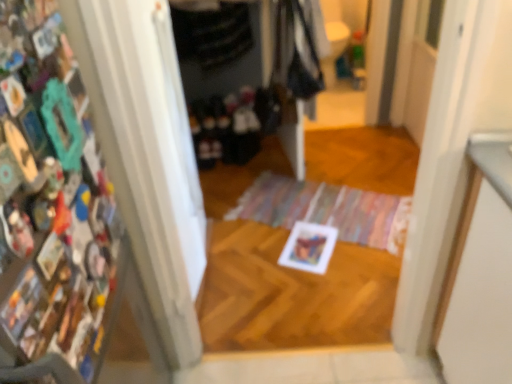
Question: Is dark fabric clothes at center, arranged as the first clothing when ordered from the bottom, closer to camera compared to dark gray fabric at upper center, the 2th clothing ordered from the bottom?

Choices:
 (A) no
 (B) yes

Answer: (A)

Question: Is the depth of dark fabric clothes at center, arranged as the first clothing when ordered from the bottom, greater than that of dark gray fabric at upper center, the first clothing viewed from the top?

Choices:
 (A) no
 (B) yes

Answer: (B)

Question: Considering the relative sizes of dark fabric clothes at center, arranged as the first clothing when ordered from the bottom, and dark gray fabric at upper center, the 2th clothing ordered from the bottom, in the image provided, is dark fabric clothes at center, arranged as the first clothing when ordered from the bottom, wider than dark gray fabric at upper center, the 2th clothing ordered from the bottom,?

Choices:
 (A) no
 (B) yes

Answer: (B)

Question: Does dark fabric clothes at center, arranged as the first clothing when ordered from the bottom, have a lesser width compared to dark gray fabric at upper center, the first clothing viewed from the top?

Choices:
 (A) no
 (B) yes

Answer: (A)

Question: Could you tell me if dark fabric clothes at center, which ranks as the 2th clothing in top-to-bottom order, is turned towards dark gray fabric at upper center, the 2th clothing ordered from the bottom?

Choices:
 (A) no
 (B) yes

Answer: (A)

Question: Is dark fabric clothes at center, arranged as the first clothing when ordered from the bottom, completely or partially outside of dark gray fabric at upper center, the 2th clothing ordered from the bottom?

Choices:
 (A) yes
 (B) no

Answer: (A)

Question: Does multicolored collage at left come behind dark fabric clothes at center, which ranks as the 2th clothing in top-to-bottom order?

Choices:
 (A) no
 (B) yes

Answer: (A)

Question: From a real-world perspective, is multicolored collage at left beneath dark fabric clothes at center, arranged as the first clothing when ordered from the bottom?

Choices:
 (A) yes
 (B) no

Answer: (B)

Question: Can you confirm if multicolored collage at left is thinner than dark fabric clothes at center, arranged as the first clothing when ordered from the bottom?

Choices:
 (A) yes
 (B) no

Answer: (A)

Question: Considering the relative positions of multicolored collage at left and dark fabric clothes at center, which ranks as the 2th clothing in top-to-bottom order, in the image provided, is multicolored collage at left to the left of dark fabric clothes at center, which ranks as the 2th clothing in top-to-bottom order, from the viewer's perspective?

Choices:
 (A) yes
 (B) no

Answer: (A)

Question: From the image's perspective, is multicolored collage at left below dark fabric clothes at center, arranged as the first clothing when ordered from the bottom?

Choices:
 (A) yes
 (B) no

Answer: (A)

Question: Are multicolored collage at left and dark fabric clothes at center, arranged as the first clothing when ordered from the bottom, located far from each other?

Choices:
 (A) no
 (B) yes

Answer: (B)

Question: From the image's perspective, is multicolored collage at left below dark gray fabric at upper center, the first clothing viewed from the top?

Choices:
 (A) yes
 (B) no

Answer: (A)